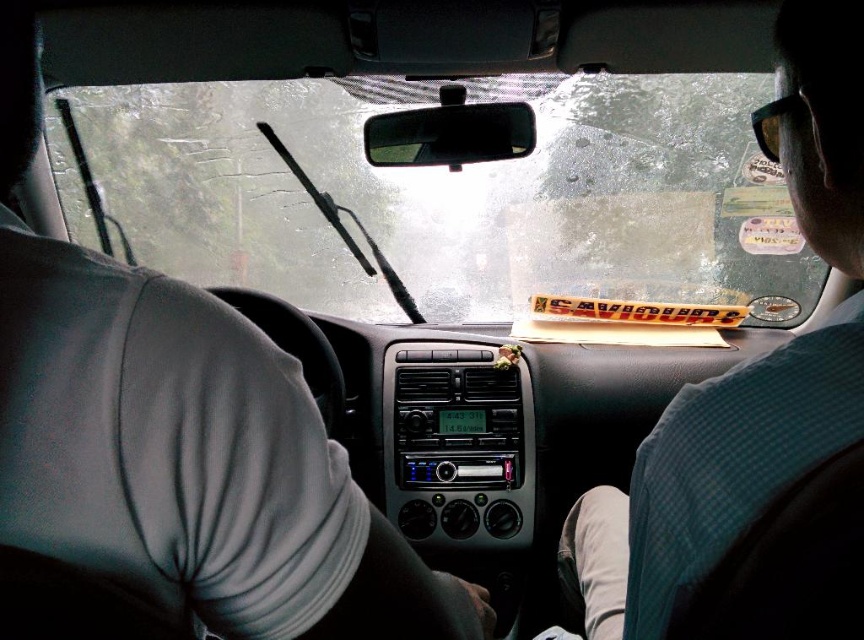
Please use the coordinates provided to determine the position of the transparent glass windshield at center. Is it located in the upper half or lower half of the image?

The transparent glass windshield at center is located at coordinates point (449, 195). Since the y coordinate is 0.521 which is above 0.5, it is in the upper half of the image.

In the scene shown: You are a passenger in a car and want to know if the transparent glass windshield at center can fully cover the green checkered shirt at upper right when viewed from your seat. Can it?

The transparent glass windshield at center is wider than the green checkered shirt at upper right, so yes, it can fully cover the green checkered shirt at upper right when viewed from your seat.